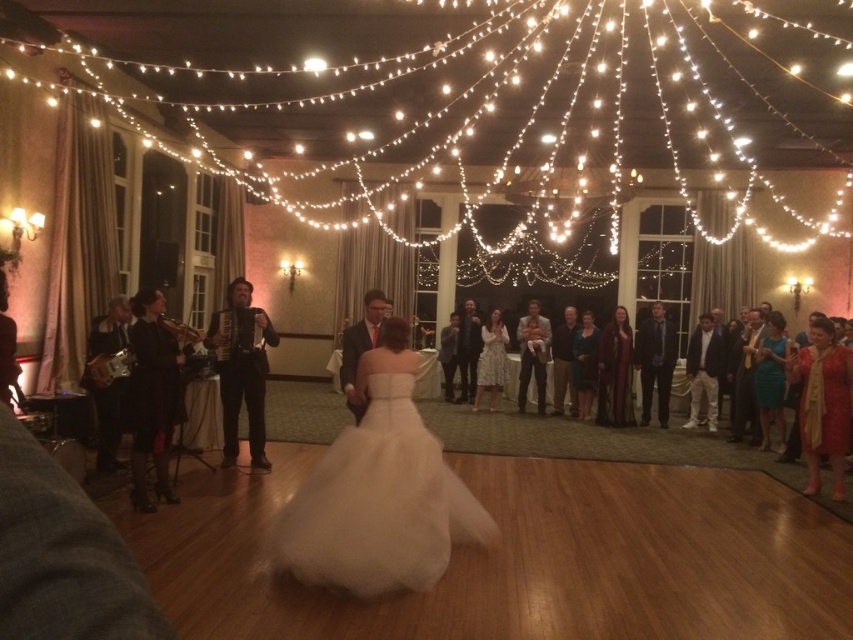
Question: In this image, where is white tulle dress at center located relative to smooth beige baby at center?

Choices:
 (A) left
 (B) right

Answer: (A)

Question: Which object is closer to the camera taking this photo?

Choices:
 (A) shiny red dress at right
 (B) black leather accordion at left

Answer: (B)

Question: Is dark gray suit at center wider than white lace dress at center?

Choices:
 (A) yes
 (B) no

Answer: (A)

Question: Which point appears farthest from the camera in this image?

Choices:
 (A) (254, 342)
 (B) (662, 328)
 (C) (132, 451)

Answer: (B)

Question: Is white tulle dress at center above shiny red dress at right?

Choices:
 (A) yes
 (B) no

Answer: (B)

Question: Which object is positioned farthest from the black leather accordion at left?

Choices:
 (A) matte black accordion at center
 (B) white tulle dress at center
 (C) dark gray suit at center

Answer: (C)